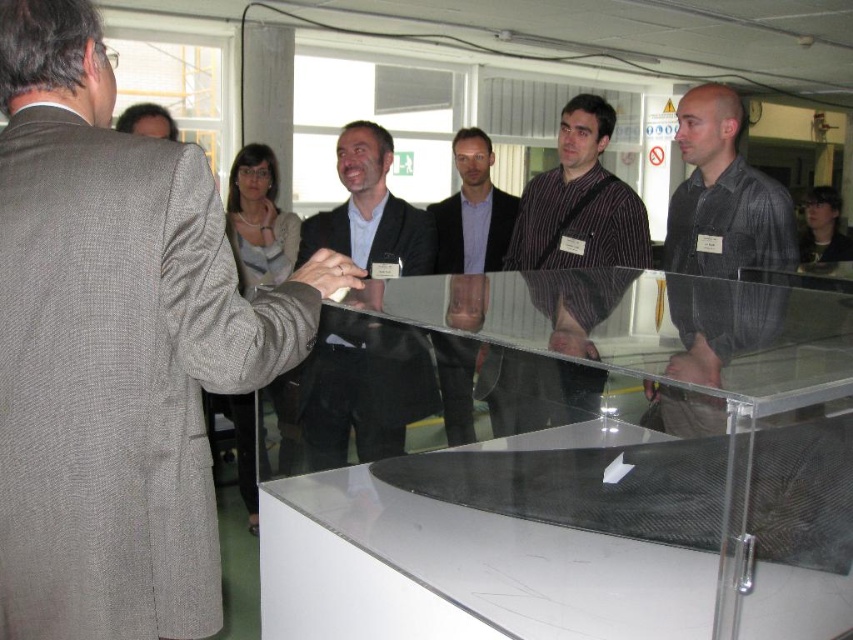
You are attending a presentation and notice a transparent acrylic table at center and a striped cotton shirt at center. Which object is positioned lower in the scene?

The transparent acrylic table at center is positioned lower than the striped cotton shirt at center.

You are a photographer in the room and want to take a photo of the matte black suit at center without including the dark brown hair at upper right in the frame. Is this possible based on their positions?

The matte black suit at center is positioned under dark brown hair at upper right, so it is possible to frame the photo to include the matte black suit at center while excluding the dark brown hair at upper right by adjusting the camera angle or cropping the upper part of the image.